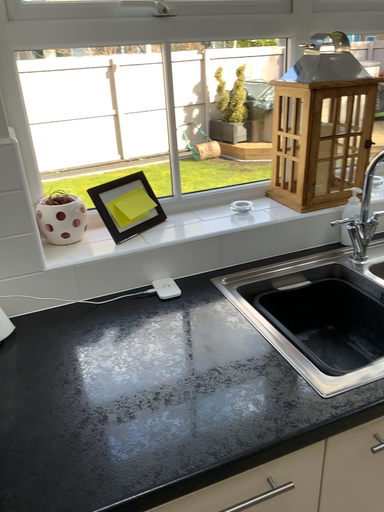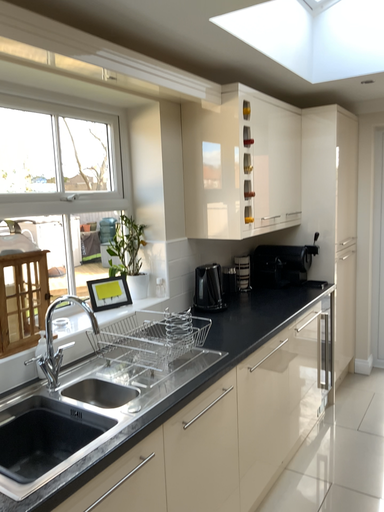
Question: Which way did the camera rotate in the video?

Choices:
 (A) rotated upward
 (B) rotated downward

Answer: (A)